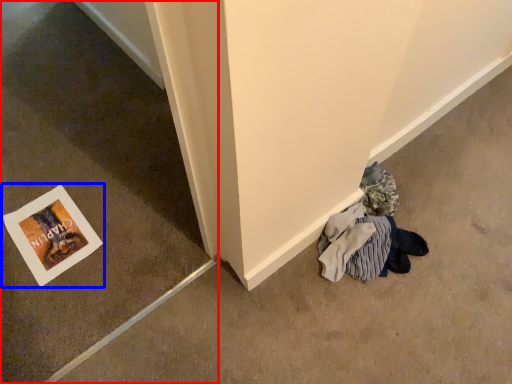
Question: Which of the following is the farthest to the observer, concrete (highlighted by a red box) or picture frame (highlighted by a blue box)?

Choices:
 (A) concrete
 (B) picture frame

Answer: (B)